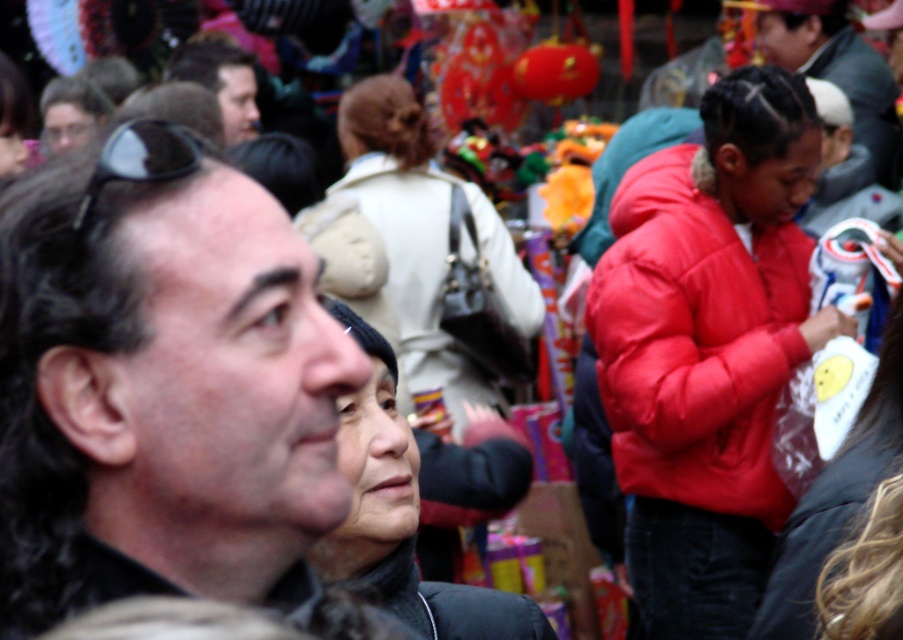
Does beige fabric jacket at center lie in front of black matte sunglasses at upper left?

No, it is behind black matte sunglasses at upper left.

Does beige fabric jacket at center come behind black matte sunglasses at upper left?

Yes.

Locate an element on the screen. The width and height of the screenshot is (903, 640). beige fabric jacket at center is located at coordinates (436, 272).

Can you confirm if black matte sunglasses at upper left is positioned above matte black sunglasses at upper left?

No.

Is black matte sunglasses at upper left smaller than matte black sunglasses at upper left?

Indeed, black matte sunglasses at upper left has a smaller size compared to matte black sunglasses at upper left.

Between point (82, 216) and point (63, 138), which one is positioned in front?

Point (82, 216) is in front.

Where is `black matte sunglasses at upper left`? black matte sunglasses at upper left is located at coordinates (143, 157).

Which is behind, point (21, 492) or point (175, 157)?

The point (175, 157) is behind.

Which is in front, point (128, 404) or point (116, 179)?

Positioned in front is point (128, 404).

In order to click on dark brown hair at center in this screenshot , I will do `click(164, 390)`.